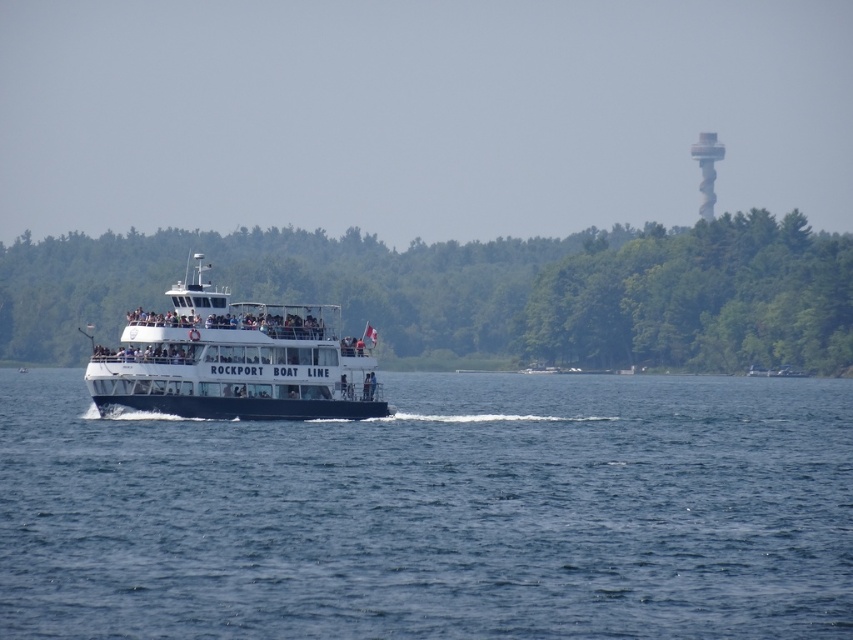
Question: Is the position of blue water at center less distant than that of white spiral tower at upper right?

Choices:
 (A) no
 (B) yes

Answer: (B)

Question: Which of the following is the farthest from the observer?

Choices:
 (A) (160, 401)
 (B) (646, 380)
 (C) (32, 326)

Answer: (C)

Question: Which point is closer to the camera?

Choices:
 (A) (517, 282)
 (B) (701, 172)

Answer: (A)

Question: Which point is closer to the camera?

Choices:
 (A) green leafy trees at center
 (B) white spiral tower at upper right
 (C) white glossy boat at center
 (D) blue water at center

Answer: (D)

Question: Is blue water at center further to the viewer compared to green leafy trees at center?

Choices:
 (A) no
 (B) yes

Answer: (A)

Question: Is white glossy boat at center below white spiral tower at upper right?

Choices:
 (A) yes
 (B) no

Answer: (A)